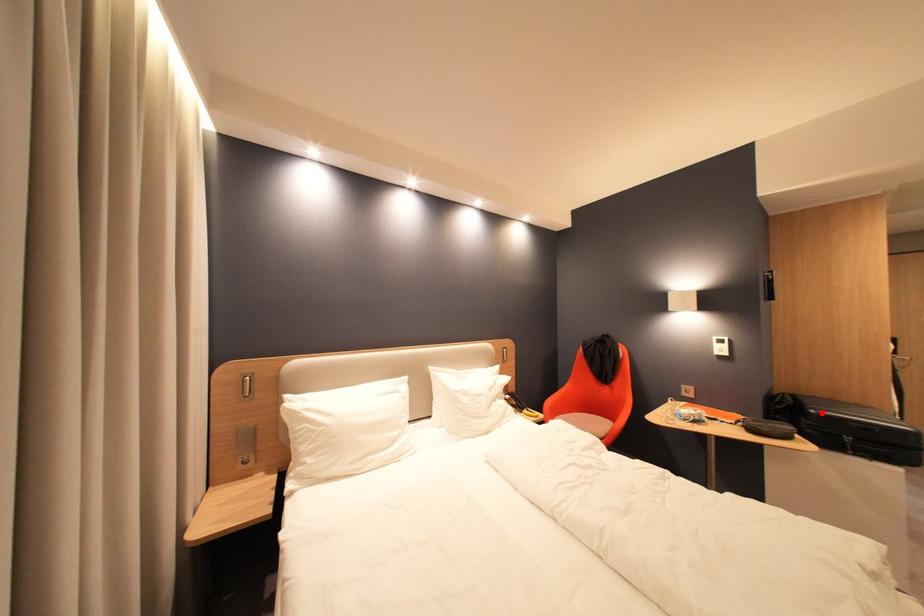
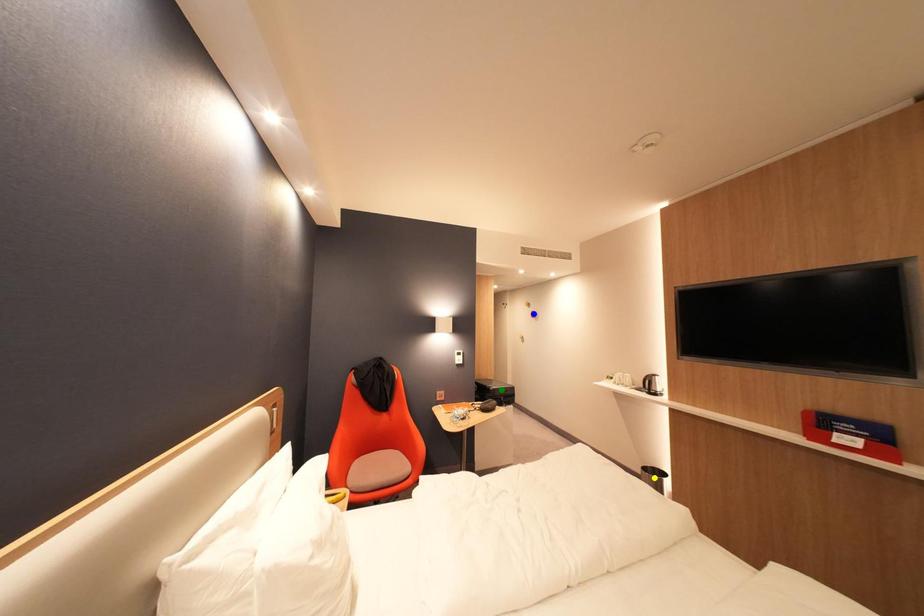
Question: I am providing you with two images of the same scene from different viewpoints. A red point is marked on the first image. You are given multiple points on the second image. In image 2, which mark is for the same physical point as the one in image 1?

Choices:
 (A) green point
 (B) yellow point
 (C) blue point

Answer: (A)